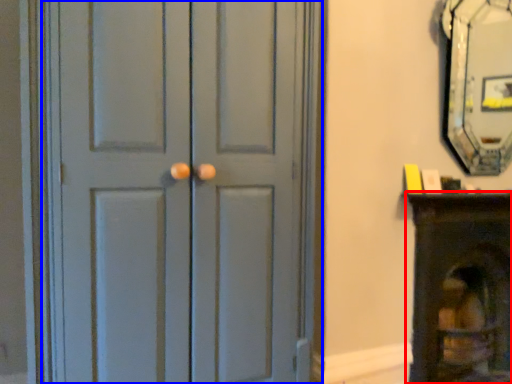
Question: Which object appears farthest to the camera in this image, furniture (highlighted by a red box) or door (highlighted by a blue box)?

Choices:
 (A) furniture
 (B) door

Answer: (A)